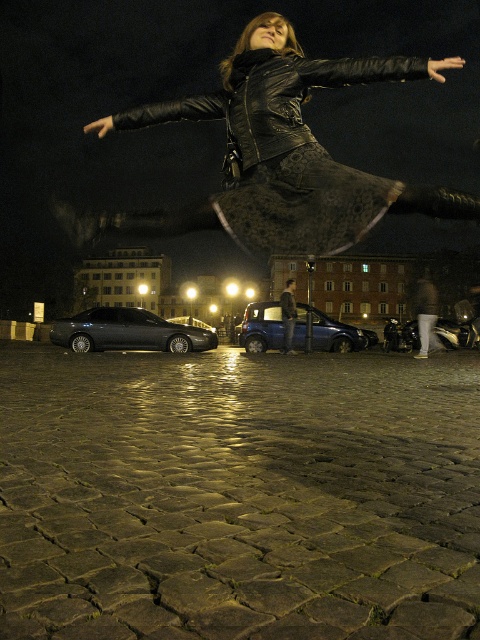
Question: Which object is closer to the camera taking this photo?

Choices:
 (A) dark stone paving at center
 (B) blue metallic car at center
 (C) black leather jacket at center

Answer: (A)

Question: In this image, where is dark stone paving at center located relative to blue metallic car at center?

Choices:
 (A) above
 (B) below

Answer: (B)

Question: Is shiny black sedan at center-left to the left of blue metallic car at center from the viewer's perspective?

Choices:
 (A) yes
 (B) no

Answer: (A)

Question: Estimate the real-world distances between objects in this image. Which object is closer to the black leather jacket at center?

Choices:
 (A) shiny black sedan at center-left
 (B) blue metallic car at center
 (C) dark stone paving at center

Answer: (C)

Question: In this image, where is dark stone paving at center located relative to shiny black sedan at center-left?

Choices:
 (A) left
 (B) right

Answer: (B)

Question: Which of the following is the farthest from the observer?

Choices:
 (A) shiny black sedan at center-left
 (B) blue metallic car at center

Answer: (B)